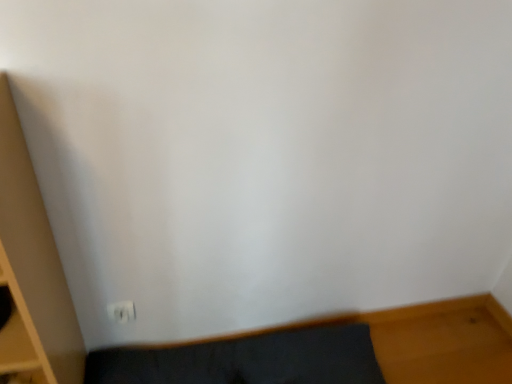
This screenshot has width=512, height=384. Identify the location of dark gray fabric rug at lower left. (247, 359).

What do you see at coordinates (247, 359) in the screenshot? I see `dark gray fabric rug at lower left` at bounding box center [247, 359].

The height and width of the screenshot is (384, 512). What do you see at coordinates (121, 311) in the screenshot?
I see `white plastic electric outlet at lower left` at bounding box center [121, 311].

Find the location of a particular element. Image resolution: width=512 pixels, height=384 pixels. white plastic electric outlet at lower left is located at coordinates (121, 311).

At what (x,y) coordinates should I click in order to perform the action: click on dark gray fabric rug at lower left. Please return your answer as a coordinate pair (x, y). This screenshot has width=512, height=384. Looking at the image, I should click on (247, 359).

Which is more to the left, white plastic electric outlet at lower left or dark gray fabric rug at lower left?

Positioned to the left is white plastic electric outlet at lower left.

Which object is further away from the camera taking this photo, white plastic electric outlet at lower left or dark gray fabric rug at lower left?

white plastic electric outlet at lower left.

Does point (110, 307) lie behind point (94, 372)?

No.

From the image's perspective, which is above, white plastic electric outlet at lower left or dark gray fabric rug at lower left?

white plastic electric outlet at lower left.

From a real-world perspective, which object rests below the other?

dark gray fabric rug at lower left.

Looking at their sizes, would you say white plastic electric outlet at lower left is wider or thinner than dark gray fabric rug at lower left?

In the image, white plastic electric outlet at lower left appears to be more narrow than dark gray fabric rug at lower left.

Is white plastic electric outlet at lower left taller than dark gray fabric rug at lower left?

No, white plastic electric outlet at lower left is not taller than dark gray fabric rug at lower left.

Is white plastic electric outlet at lower left bigger than dark gray fabric rug at lower left?

Actually, white plastic electric outlet at lower left might be smaller than dark gray fabric rug at lower left.

Is white plastic electric outlet at lower left surrounding dark gray fabric rug at lower left?

No, dark gray fabric rug at lower left is located outside of white plastic electric outlet at lower left.

Is white plastic electric outlet at lower left with dark gray fabric rug at lower left?

No, white plastic electric outlet at lower left is not making contact with dark gray fabric rug at lower left.

Does white plastic electric outlet at lower left turn towards dark gray fabric rug at lower left?

No, white plastic electric outlet at lower left is not turned towards dark gray fabric rug at lower left.

This screenshot has height=384, width=512. What are the coordinates of `furniture that is under the white plastic electric outlet at lower left (from a real-world perspective)` in the screenshot? It's located at (247, 359).

Can you confirm if dark gray fabric rug at lower left is positioned to the left of white plastic electric outlet at lower left?

Incorrect, dark gray fabric rug at lower left is not on the left side of white plastic electric outlet at lower left.

Is the depth of dark gray fabric rug at lower left greater than that of white plastic electric outlet at lower left?

No, the depth of dark gray fabric rug at lower left is less than that of white plastic electric outlet at lower left.

Between point (100, 374) and point (129, 301), which one is positioned behind?

Point (100, 374)

From the image's perspective, is dark gray fabric rug at lower left above or below white plastic electric outlet at lower left?

Based on their image positions, dark gray fabric rug at lower left is located beneath white plastic electric outlet at lower left.

From a real-world perspective, does dark gray fabric rug at lower left stand above white plastic electric outlet at lower left?

Incorrect, from a real-world perspective, dark gray fabric rug at lower left is lower than white plastic electric outlet at lower left.

Which of these two, dark gray fabric rug at lower left or white plastic electric outlet at lower left, is thinner?

With smaller width is white plastic electric outlet at lower left.

Which of these two, dark gray fabric rug at lower left or white plastic electric outlet at lower left, stands taller?

Standing taller between the two is dark gray fabric rug at lower left.

From the picture: Considering the sizes of objects dark gray fabric rug at lower left and white plastic electric outlet at lower left in the image provided, who is bigger, dark gray fabric rug at lower left or white plastic electric outlet at lower left?

With larger size is dark gray fabric rug at lower left.

Is dark gray fabric rug at lower left not inside white plastic electric outlet at lower left?

Yes, dark gray fabric rug at lower left is not within white plastic electric outlet at lower left.

Is dark gray fabric rug at lower left placed right next to white plastic electric outlet at lower left?

No, dark gray fabric rug at lower left is not in contact with white plastic electric outlet at lower left.

Is dark gray fabric rug at lower left turned away from white plastic electric outlet at lower left?

No, white plastic electric outlet at lower left is not at the back of dark gray fabric rug at lower left.

Find the location of a particular element. furniture on the right of the white plastic electric outlet at lower left is located at coordinates (247, 359).

Identify the location of furniture that is on the right side of white plastic electric outlet at lower left. (247, 359).

This screenshot has height=384, width=512. I want to click on electric outlet above the dark gray fabric rug at lower left (from a real-world perspective), so click(121, 311).